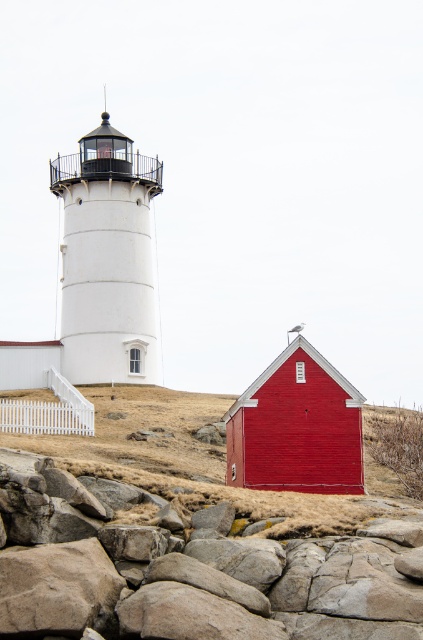
From the picture: You are standing at the base of the lighthouse in the coastal scene. You notice two points marked in the image. The first point is at coordinates point (247, 566), and the second is at point (82, 392). Which of these points is nearer to your current position?

Point (247, 566) is closer to the camera than point (82, 392), so the first point is nearer to your current position.

You are a geologist examining the coastal area in the image. You need to locate the gray rough rock at lower left. According to the coordinates provided, where exactly is it positioned?

The gray rough rock at lower left is positioned at point (189, 573).

You are a painter setting up your easel to capture the coastal scene. You want to place your easel so that both the gray rough rock at lower left and the smooth red barn at center are visible in your painting. Based on their positions, which object should be placed to the right side of your canvas?

The gray rough rock at lower left is to the right of the smooth red barn at center, so to include both in your painting, you should position the gray rough rock at lower left on the right side of your canvas and the smooth red barn at center on the left side.